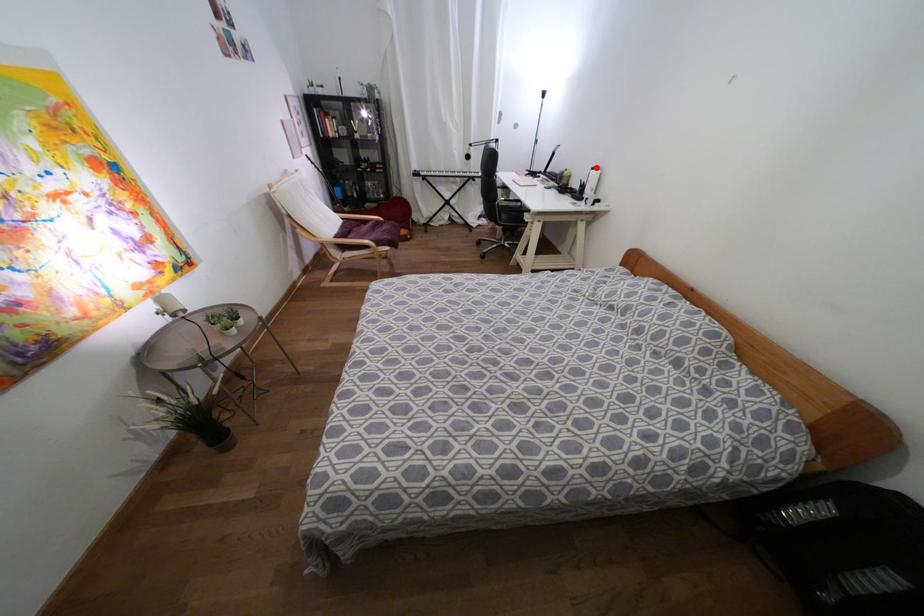
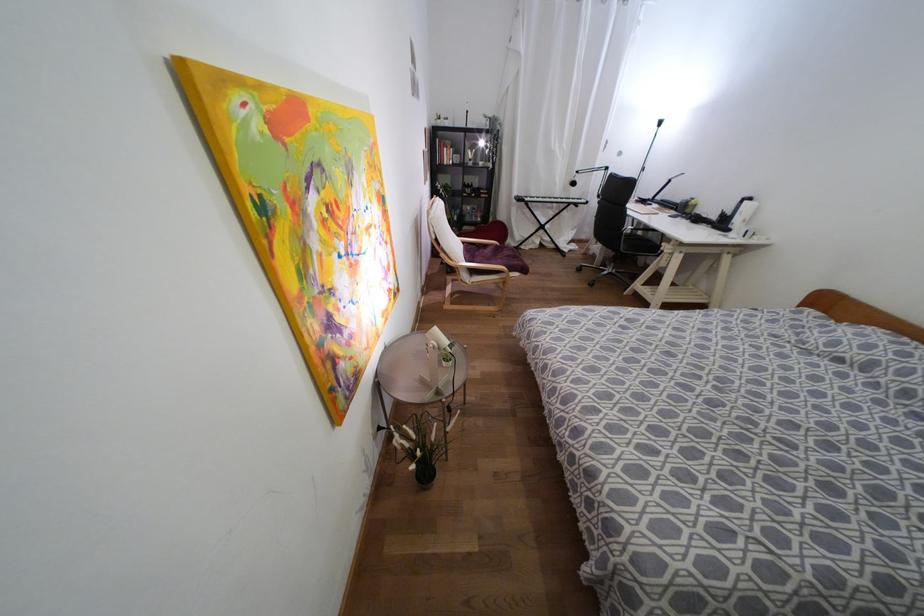
Question: I am providing you with two images of the same scene from different viewpoints. Given a red point in image1, look at the same physical point in image2. Is it:

Choices:
 (A) Closer to the viewpoint
 (B) Farther from the viewpoint

Answer: (B)